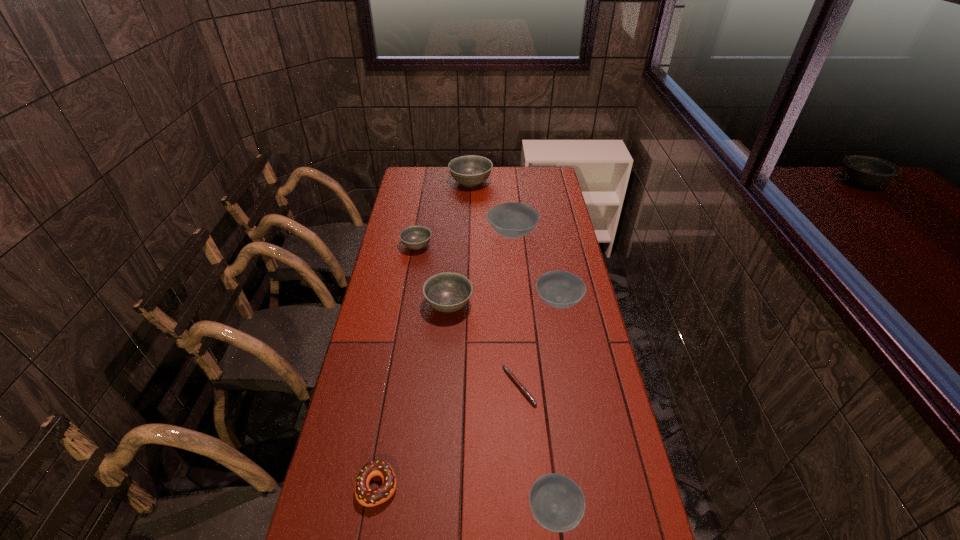
I want to click on the biggest gray bowl, so click(x=471, y=170).

Where is `the farthest gray bowl`? the farthest gray bowl is located at coordinates (471, 170).

The height and width of the screenshot is (540, 960). In order to click on the biggest brown bowl in this screenshot , I will do `click(513, 220)`.

The width and height of the screenshot is (960, 540). Find the location of `the nearest gray bowl`. the nearest gray bowl is located at coordinates (447, 292).

Identify the location of the second nearest brown bowl. (560, 289).

What are the coordinates of `the second nearest gray bowl` in the screenshot? It's located at (414, 237).

At what (x,y) coordinates should I click in order to perform the action: click on the second shortest object. Please return your answer as a coordinate pair (x, y). The width and height of the screenshot is (960, 540). Looking at the image, I should click on pos(365,496).

Locate an element on the screen. brown doughnut is located at coordinates (365, 496).

Identify the location of pen. The width and height of the screenshot is (960, 540). (522, 389).

The height and width of the screenshot is (540, 960). Find the location of `the sixth farthest object`. the sixth farthest object is located at coordinates (522, 389).